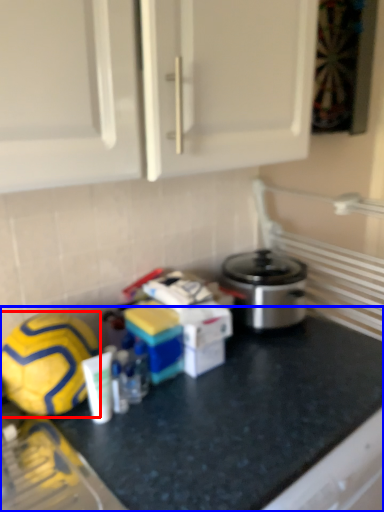
Question: Which object appears closest to the camera in this image, football (highlighted by a red box) or counter (highlighted by a blue box)?

Choices:
 (A) football
 (B) counter

Answer: (B)